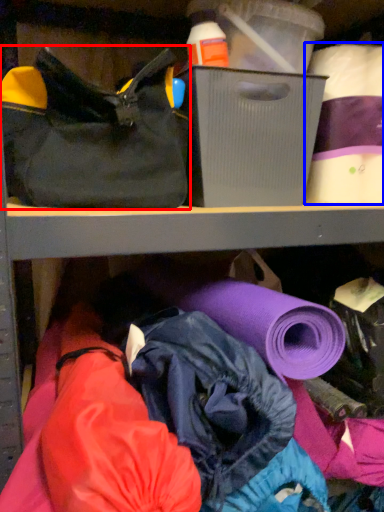
Question: Which object appears closest to the camera in this image, handbag (highlighted by a red box) or toilet paper (highlighted by a blue box)?

Choices:
 (A) handbag
 (B) toilet paper

Answer: (A)